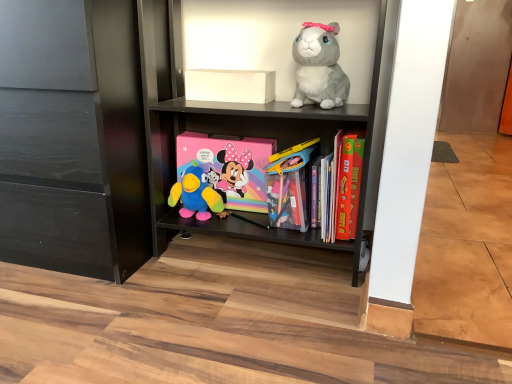
Question: Is translucent plastic container at center, which is the second toy from left to right, taller or shorter than plush blue bird at center, the 1th toy from the left?

Choices:
 (A) tall
 (B) short

Answer: (A)

Question: Considering the positions of translucent plastic container at center, the 2th toy positioned from the right, and plush blue bird at center, the 3th toy viewed from the right, in the image, is translucent plastic container at center, the 2th toy positioned from the right, wider or thinner than plush blue bird at center, the 3th toy viewed from the right,?

Choices:
 (A) thin
 (B) wide

Answer: (A)

Question: Estimate the real-world distances between objects in this image. Which object is farther from the plush blue bird at center, the 1th toy from the left?

Choices:
 (A) white matte box at upper center
 (B) matte black shelf at center
 (C) black matte cabinet at lower left
 (D) translucent plastic container at center, which is the second toy from left to right
 (E) pastel matte minnie mouse comic book at center

Answer: (C)

Question: Considering the real-world distances, which object is farthest from the matte black shelf at center?

Choices:
 (A) white matte box at upper center
 (B) black matte cabinet at lower left
 (C) hardcover book at center right
 (D) pastel matte minnie mouse comic book at center
 (E) translucent plastic container at center, the 2th toy positioned from the right

Answer: (B)